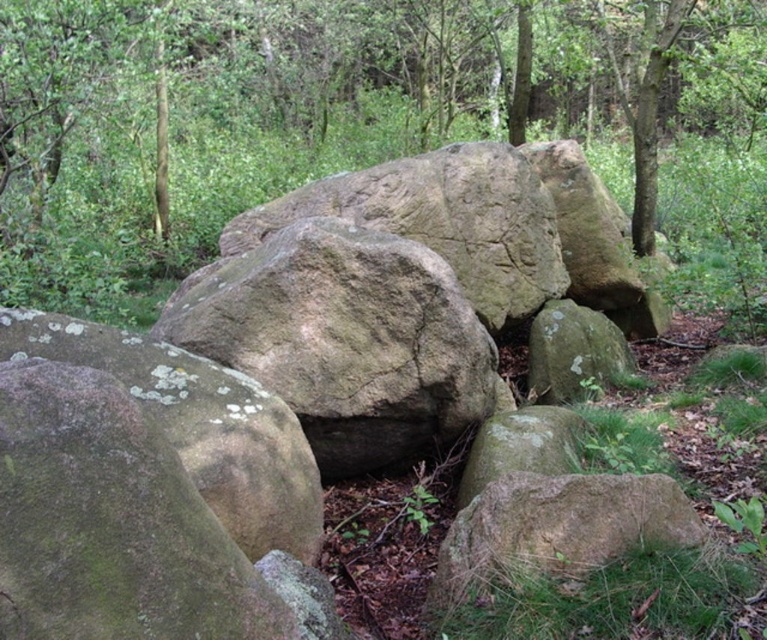
You are standing in the forest and see the smooth beige rock at center and the green mossy rock at lower center. Which rock is positioned more to the left side?

The smooth beige rock at center is positioned to the left of the green mossy rock at lower center, so it is more to the left side.

You are a hiker trying to place a small flag on the closest rock to you. Which rock should you choose between the smooth beige rock at center and the smooth gray rock at center?

The smooth beige rock at center is closer to the viewer, so you should place the flag on the smooth beige rock at center.